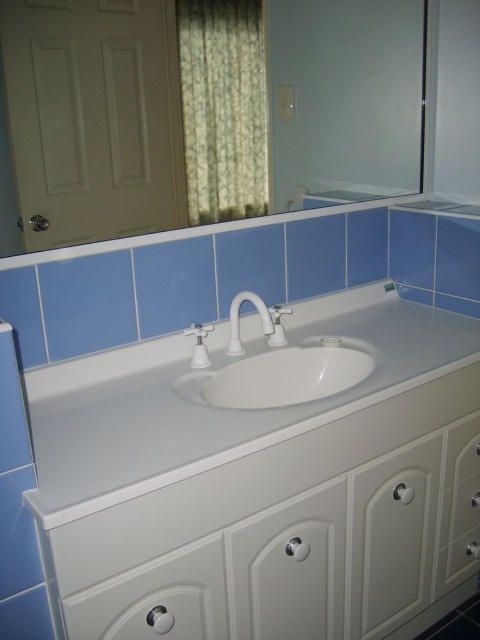
Which of these two, clear glass mirror at upper center or green floral fabric curtain at upper center, stands taller?

clear glass mirror at upper center

This screenshot has width=480, height=640. What do you see at coordinates (204, 113) in the screenshot?
I see `clear glass mirror at upper center` at bounding box center [204, 113].

Between point (142, 92) and point (211, 70), which one is positioned behind?

The point (211, 70) is more distant.

The width and height of the screenshot is (480, 640). Identify the location of clear glass mirror at upper center. (204, 113).

Which is above, white glossy sink at center or white glossy faucet at center?

Positioned higher is white glossy faucet at center.

Between white glossy sink at center and white glossy faucet at center, which one has more height?

white glossy sink at center is taller.

Identify the location of white glossy sink at center. The image size is (480, 640). (278, 376).

Between white glossy countertop at center and white glossy sink at center, which one has more height?

With more height is white glossy countertop at center.

Can you confirm if white glossy countertop at center is positioned below white glossy sink at center?

Indeed, white glossy countertop at center is positioned under white glossy sink at center.

Where is `white glossy countertop at center`? white glossy countertop at center is located at coordinates (217, 397).